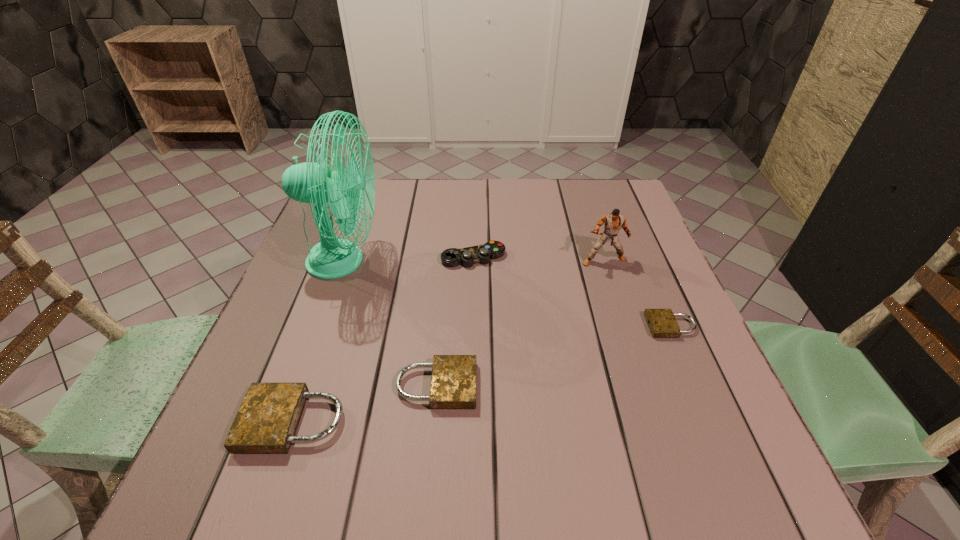
Please point a spot to place another padlock for symmetrical spacing. Please provide its 2D coordinates. Your answer should be formatted as a tuple, i.e. [(x, y)], where the tuple contains the x and y coordinates of a point satisfying the conditions above.

[(562, 354)]